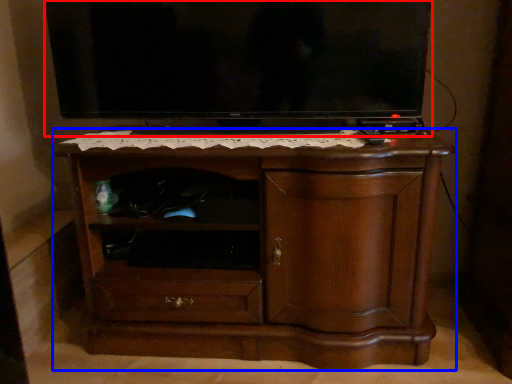
Question: Which object is closer to the camera taking this photo, television (highlighted by a red box) or chest of drawers (highlighted by a blue box)?

Choices:
 (A) television
 (B) chest of drawers

Answer: (B)